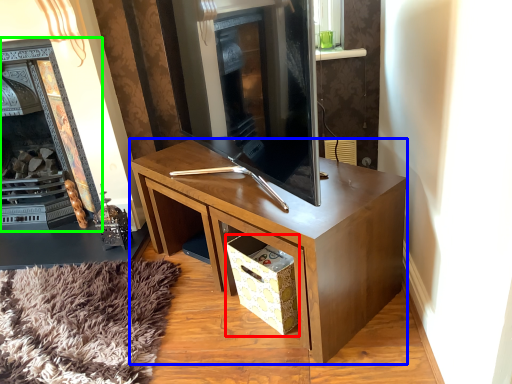
Question: Which object is the farthest from drawer (highlighted by a red box)? Choose among these: desk (highlighted by a blue box) or fireplace (highlighted by a green box).

Choices:
 (A) desk
 (B) fireplace

Answer: (B)